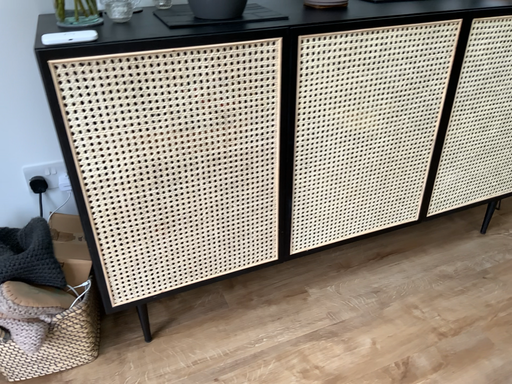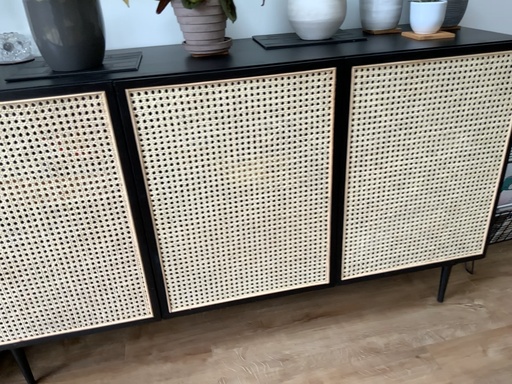
Question: How did the camera likely rotate when shooting the video?

Choices:
 (A) rotated left
 (B) rotated right

Answer: (A)